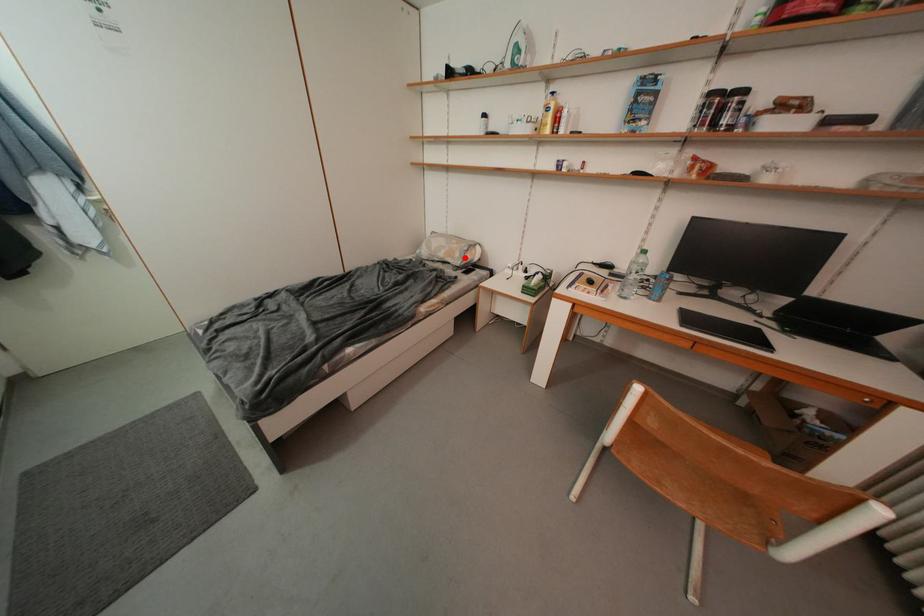
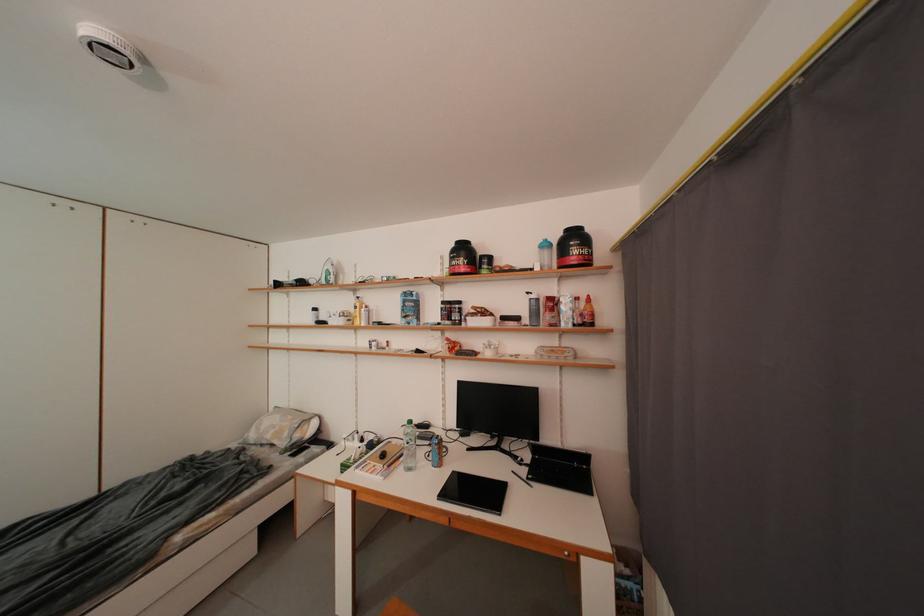
Where in the second image is the point corresponding to the highlighted location from the first image?

(294, 438)